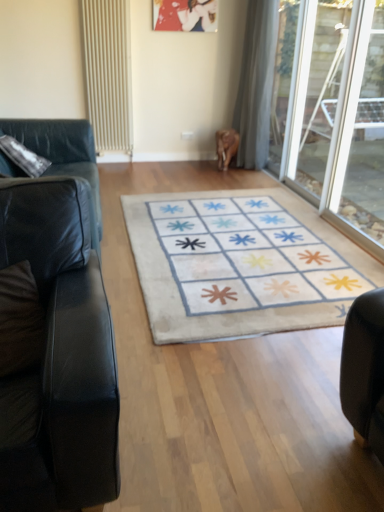
I want to click on free space in front of beige textured radiator at upper left, so [x=117, y=169].